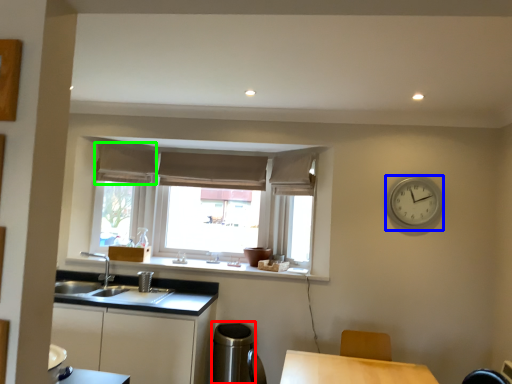
Question: Based on their relative distances, which object is nearer to appliance (highlighted by a red box)? Choose from clock (highlighted by a blue box) and curtain (highlighted by a green box).

Choices:
 (A) clock
 (B) curtain

Answer: (A)